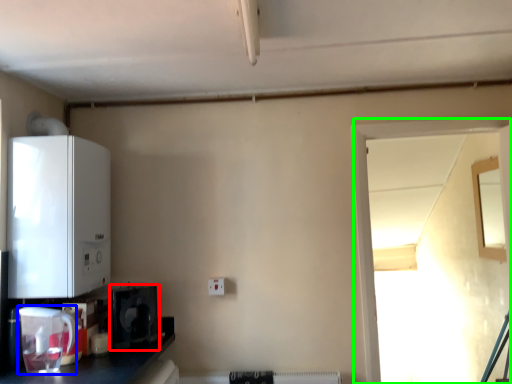
Question: Which object is the farthest from appliance (highlighted by a red box)? Choose among these: appliance (highlighted by a blue box) or window (highlighted by a green box).

Choices:
 (A) appliance
 (B) window

Answer: (B)